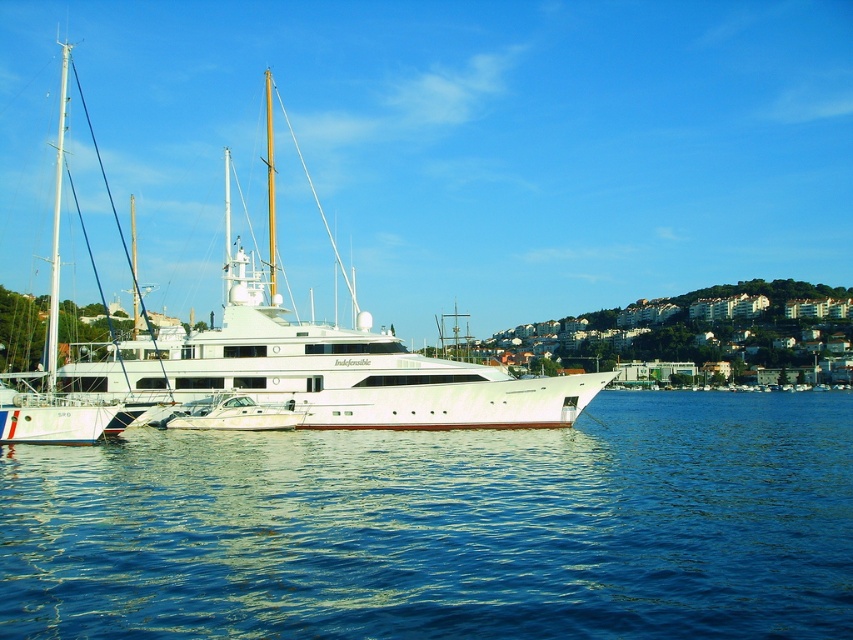
You are standing on the dock and looking at the blue liquid water at lower center and the white glossy yacht at center. Which object appears taller from your viewpoint?

The white glossy yacht at center appears taller than the blue liquid water at lower center because the blue liquid water at lower center has a lesser height compared to it.

You are standing at the point labeled as point (445,528) in the image. What object is directly below you?

The blue liquid water at lower center is located at point (445,528), so the object directly below you is the blue liquid water at lower center.

You are planning to dock your boat at the marina. You see the white glossy yacht at center and the white matte sailboat at left. Which boat has a wider deck for you to walk on?

The white glossy yacht at center has a wider deck than the white matte sailboat at left, so it offers more space to walk on.